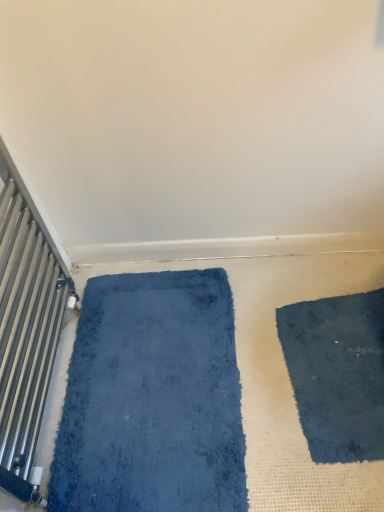
Question: Is dark blue shaggy mat at lower right oriented towards metallic silver radiator at left?

Choices:
 (A) yes
 (B) no

Answer: (B)

Question: Considering the relative sizes of dark blue shaggy mat at lower right and metallic silver radiator at left in the image provided, is dark blue shaggy mat at lower right taller than metallic silver radiator at left?

Choices:
 (A) no
 (B) yes

Answer: (A)

Question: Does dark blue shaggy mat at lower right contain metallic silver radiator at left?

Choices:
 (A) no
 (B) yes

Answer: (A)

Question: Can you confirm if dark blue shaggy mat at lower right is positioned to the right of metallic silver radiator at left?

Choices:
 (A) no
 (B) yes

Answer: (B)

Question: Is dark blue shaggy mat at lower right bigger than metallic silver radiator at left?

Choices:
 (A) no
 (B) yes

Answer: (A)

Question: Is blue plush bath mat at left inside the boundaries of dark blue shaggy mat at lower right, or outside?

Choices:
 (A) outside
 (B) inside

Answer: (A)

Question: From a real-world perspective, is blue plush bath mat at left physically located above or below dark blue shaggy mat at lower right?

Choices:
 (A) above
 (B) below

Answer: (A)

Question: Considering the positions of blue plush bath mat at left and dark blue shaggy mat at lower right in the image, is blue plush bath mat at left bigger or smaller than dark blue shaggy mat at lower right?

Choices:
 (A) small
 (B) big

Answer: (B)

Question: In the image, is blue plush bath mat at left on the left side or the right side of dark blue shaggy mat at lower right?

Choices:
 (A) left
 (B) right

Answer: (A)

Question: In terms of height, does blue plush bath mat at left look taller or shorter compared to metallic silver radiator at left?

Choices:
 (A) short
 (B) tall

Answer: (A)

Question: Visually, is blue plush bath mat at left positioned to the left or to the right of metallic silver radiator at left?

Choices:
 (A) left
 (B) right

Answer: (B)

Question: Looking at their shapes, would you say blue plush bath mat at left is wider or thinner than metallic silver radiator at left?

Choices:
 (A) thin
 (B) wide

Answer: (B)

Question: From the image's perspective, is blue plush bath mat at left positioned above or below metallic silver radiator at left?

Choices:
 (A) above
 (B) below

Answer: (B)

Question: From the image's perspective, is metallic silver radiator at left positioned above or below blue plush bath mat at left?

Choices:
 (A) below
 (B) above

Answer: (B)

Question: Considering their positions, is metallic silver radiator at left located in front of or behind blue plush bath mat at left?

Choices:
 (A) front
 (B) behind

Answer: (A)